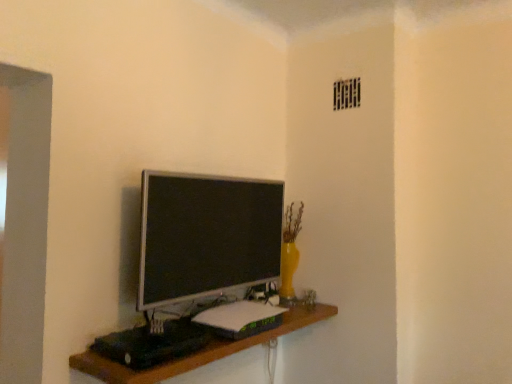
Question: Can you confirm if satin silver monitor at center is taller than wooden shelf at center?

Choices:
 (A) no
 (B) yes

Answer: (B)

Question: Is the surface of satin silver monitor at center in direct contact with wooden shelf at center?

Choices:
 (A) no
 (B) yes

Answer: (A)

Question: Does satin silver monitor at center have a smaller size compared to wooden shelf at center?

Choices:
 (A) no
 (B) yes

Answer: (B)

Question: Can you confirm if satin silver monitor at center is bigger than wooden shelf at center?

Choices:
 (A) yes
 (B) no

Answer: (B)

Question: From the image's perspective, does satin silver monitor at center appear higher than wooden shelf at center?

Choices:
 (A) yes
 (B) no

Answer: (A)

Question: Is satin silver monitor at center closer to the viewer compared to wooden shelf at center?

Choices:
 (A) yes
 (B) no

Answer: (B)

Question: Considering the relative sizes of wooden shelf at center and satin silver monitor at center in the image provided, is wooden shelf at center wider than satin silver monitor at center?

Choices:
 (A) yes
 (B) no

Answer: (A)

Question: Does wooden shelf at center appear on the right side of satin silver monitor at center?

Choices:
 (A) yes
 (B) no

Answer: (A)

Question: Considering the relative sizes of wooden shelf at center and satin silver monitor at center in the image provided, is wooden shelf at center shorter than satin silver monitor at center?

Choices:
 (A) no
 (B) yes

Answer: (B)

Question: Is wooden shelf at center facing away from satin silver monitor at center?

Choices:
 (A) no
 (B) yes

Answer: (A)

Question: Is wooden shelf at center closer to camera compared to satin silver monitor at center?

Choices:
 (A) yes
 (B) no

Answer: (A)

Question: Does wooden shelf at center appear on the left side of satin silver monitor at center?

Choices:
 (A) no
 (B) yes

Answer: (A)

Question: In terms of height, does satin silver monitor at center look taller or shorter compared to wooden shelf at center?

Choices:
 (A) short
 (B) tall

Answer: (B)